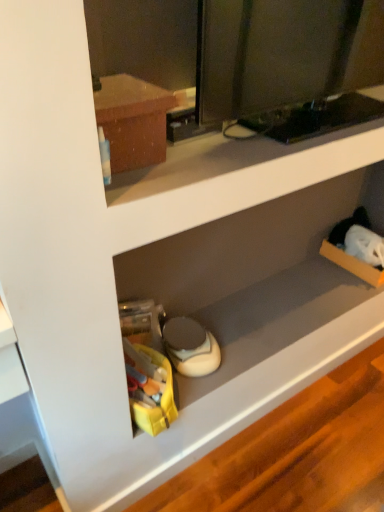
This screenshot has height=512, width=384. Identify the location of unoccupied region to the right of matte brown cabinet at upper left. (200, 158).